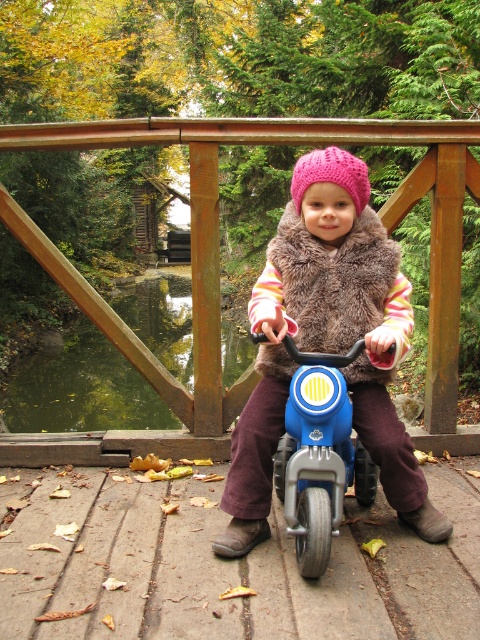
Question: From the image, what is the correct spatial relationship of matte pink knit hat at center in relation to blue plastic motorcycle at center?

Choices:
 (A) below
 (B) above

Answer: (B)

Question: Which object is farther from the camera taking this photo?

Choices:
 (A) matte pink knit hat at center
 (B) wooden rail at center
 (C) pink knitted hat at center
 (D) blue plastic motorcycle at center

Answer: (B)

Question: Which object is closer to the camera taking this photo?

Choices:
 (A) blue plastic motorcycle at center
 (B) pink knitted hat at center
 (C) matte pink knit hat at center
 (D) wooden rail at center

Answer: (A)

Question: Is wooden rail at center bigger than pink knitted hat at center?

Choices:
 (A) no
 (B) yes

Answer: (B)

Question: Considering the real-world distances, which object is farthest from the matte pink knit hat at center?

Choices:
 (A) wooden rail at center
 (B) pink knitted hat at center
 (C) blue plastic motorcycle at center

Answer: (A)

Question: Does wooden rail at center have a smaller size compared to pink knitted hat at center?

Choices:
 (A) yes
 (B) no

Answer: (B)